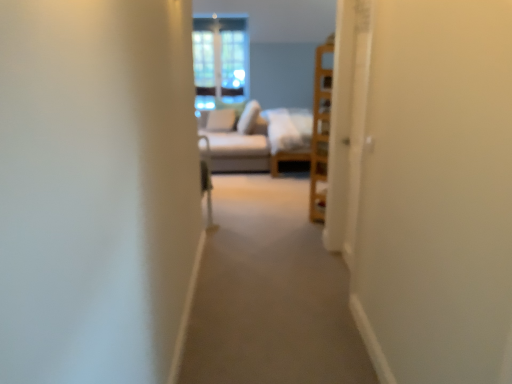
Question: Considering the relative positions of light beige fabric couch at center and clear glass window at center in the image provided, is light beige fabric couch at center to the left or to the right of clear glass window at center?

Choices:
 (A) right
 (B) left

Answer: (A)

Question: Is light beige fabric couch at center in front of or behind clear glass window at center in the image?

Choices:
 (A) front
 (B) behind

Answer: (A)

Question: Based on their relative distances, which object is nearer to the clear glass window at center?

Choices:
 (A) white soft pillow at center, the second pillow in the left-to-right sequence
 (B) white soft pillow at center, which ranks as the 2th pillow in right-to-left order
 (C) light beige fabric couch at center

Answer: (B)

Question: Based on their relative distances, which object is farther from the clear glass window at center?

Choices:
 (A) white soft pillow at center, which is the 1th pillow from right to left
 (B) white soft pillow at center, the 1th pillow viewed from the left
 (C) light beige fabric couch at center

Answer: (C)